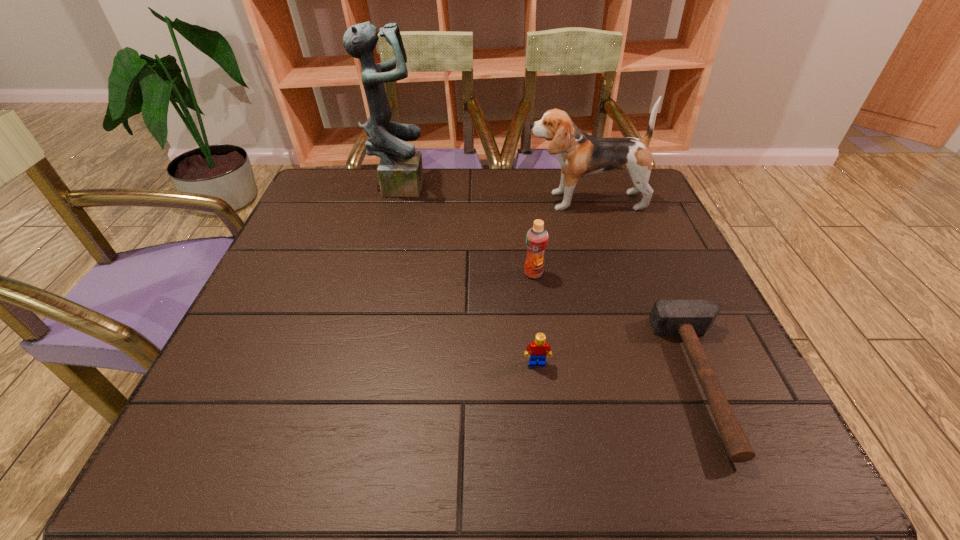
The width and height of the screenshot is (960, 540). I want to click on hammer that is positioned at the right edge, so click(687, 318).

You are a GUI agent. You are given a task and a screenshot of the screen. Output one action in this format:
    pyautogui.click(x=<x>, y=<y>)
    Task: Click on the object present at the far right corner
    
    Given the screenshot: What is the action you would take?
    pyautogui.click(x=580, y=155)

Locate an element on the screen. Image resolution: width=960 pixels, height=540 pixels. object that is at the near right corner is located at coordinates (687, 318).

This screenshot has width=960, height=540. Find the location of `free spot at the far edge of the desktop`. free spot at the far edge of the desktop is located at coordinates (466, 192).

Identify the location of vacant position at the left edge of the desktop. This screenshot has height=540, width=960. (316, 281).

The image size is (960, 540). In order to click on vacant space at the far left corner in this screenshot , I will do `click(339, 200)`.

In the image, there is a desktop. Identify the location of free space at the near left corner. Image resolution: width=960 pixels, height=540 pixels. (188, 451).

Image resolution: width=960 pixels, height=540 pixels. In the image, there is a desktop. Identify the location of free space at the near right corner. (680, 444).

Identify the location of free space that is in between the third nearest object and the hammer. (620, 327).

Find the location of a particular element. The image size is (960, 540). vacant area between the puppy and the Lego is located at coordinates (561, 282).